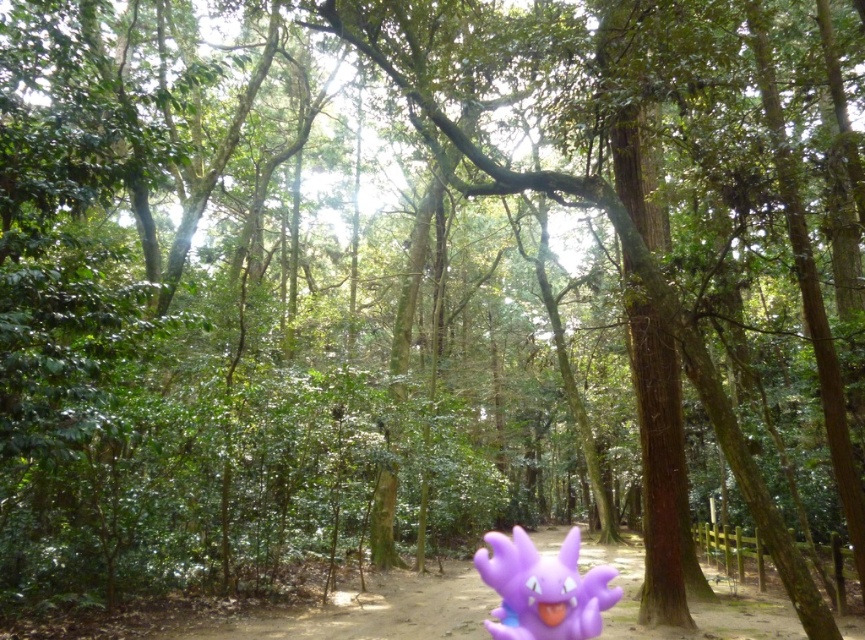
Can you confirm if purple plastic toy at center is thinner than purple matte toy at lower center?

In fact, purple plastic toy at center might be wider than purple matte toy at lower center.

Find the location of a particular element. The height and width of the screenshot is (640, 865). purple plastic toy at center is located at coordinates (373, 611).